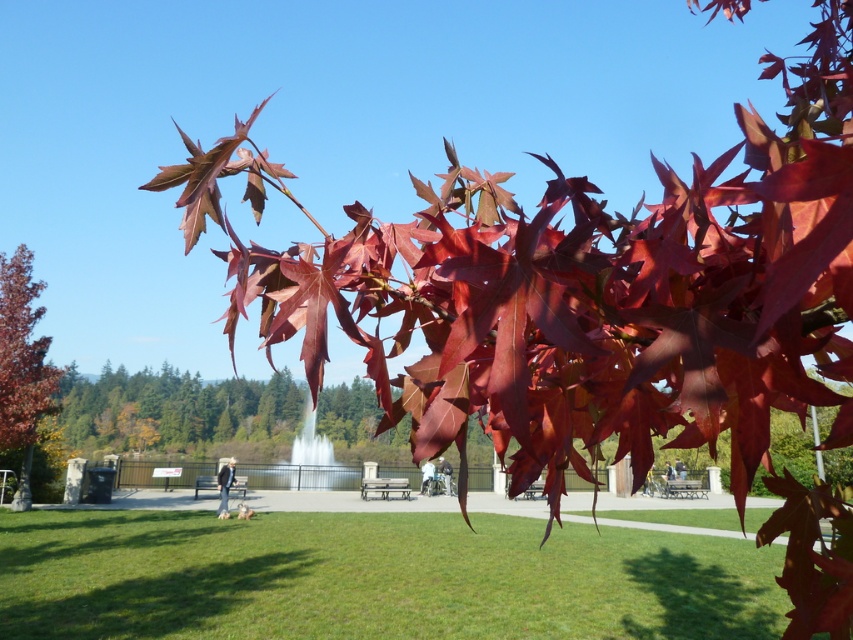
Does glossy red maple leaves at center have a greater width compared to shiny red maple leaf at upper center?

Indeed, glossy red maple leaves at center has a greater width compared to shiny red maple leaf at upper center.

Find the location of a particular element. The height and width of the screenshot is (640, 853). glossy red maple leaves at center is located at coordinates (175, 410).

Measure the distance from white glossy fountain at center to wooden park bench at center.

The distance of white glossy fountain at center from wooden park bench at center is 8.74 meters.

Based on the photo, which is more to the right, white glossy fountain at center or wooden park bench at center?

white glossy fountain at center is more to the right.

Which is behind, point (328, 442) or point (216, 486)?

Point (328, 442)

Image resolution: width=853 pixels, height=640 pixels. What are the coordinates of `white glossy fountain at center` in the screenshot? It's located at (312, 460).

Can you confirm if smooth reddish-brown tree at left is wider than white glossy fountain at center?

No, smooth reddish-brown tree at left is not wider than white glossy fountain at center.

Can you confirm if smooth reddish-brown tree at left is smaller than white glossy fountain at center?

Correct, smooth reddish-brown tree at left occupies less space than white glossy fountain at center.

Identify the location of smooth reddish-brown tree at left. tap(21, 364).